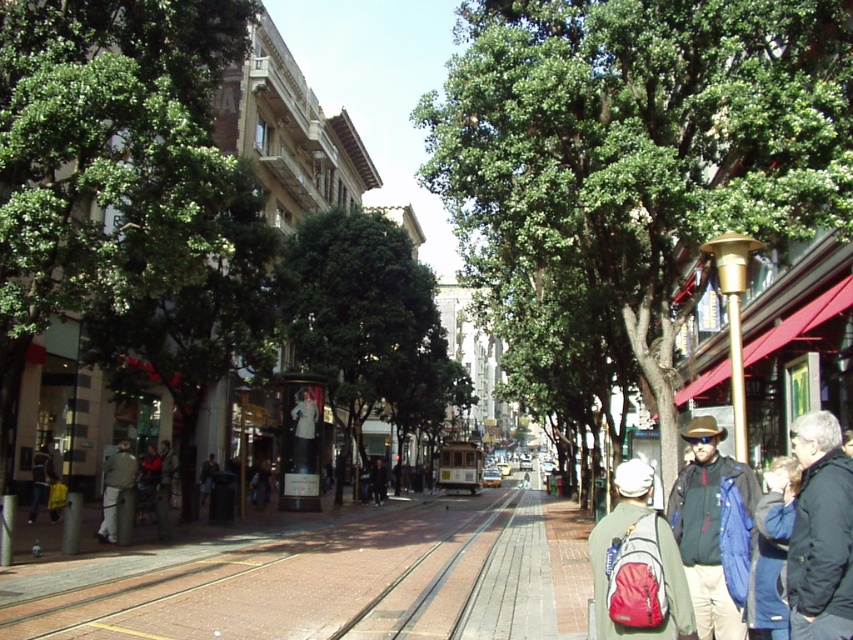
Between dark gray jacket at lower right and brick train track at center, which one appears on the left side from the viewer's perspective?

brick train track at center

Is dark gray jacket at lower right positioned behind brick train track at center?

That is False.

I want to click on dark gray jacket at lower right, so click(x=820, y=532).

Where is `dark gray jacket at lower right`? Image resolution: width=853 pixels, height=640 pixels. dark gray jacket at lower right is located at coordinates (820, 532).

Describe the element at coordinates (820, 532) in the screenshot. I see `red backpack at lower right` at that location.

Who is taller, red backpack at lower right or matte black jacket at lower right?

Standing taller between the two is matte black jacket at lower right.

The image size is (853, 640). What do you see at coordinates (820, 532) in the screenshot?
I see `red backpack at lower right` at bounding box center [820, 532].

Where is `red backpack at lower right`? This screenshot has height=640, width=853. red backpack at lower right is located at coordinates (820, 532).

Is brick pavement at center positioned behind dark gray jacket at lower right?

Yes, it is.

Does point (345, 592) lie in front of point (817, 589)?

No, (345, 592) is further to viewer.

Identify the location of brick pavement at center. Image resolution: width=853 pixels, height=640 pixels. (331, 584).